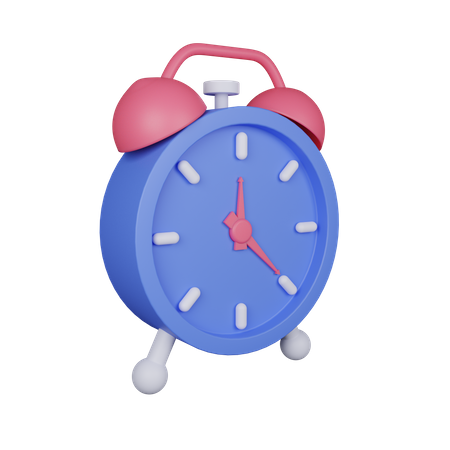
You are a GUI agent. You are given a task and a screenshot of the screen. Output one action in this format:
    pyautogui.click(x=<x>, y=<y>)
    Task: Click on the clock
    
    Given the screenshot: What is the action you would take?
    pyautogui.click(x=223, y=192)